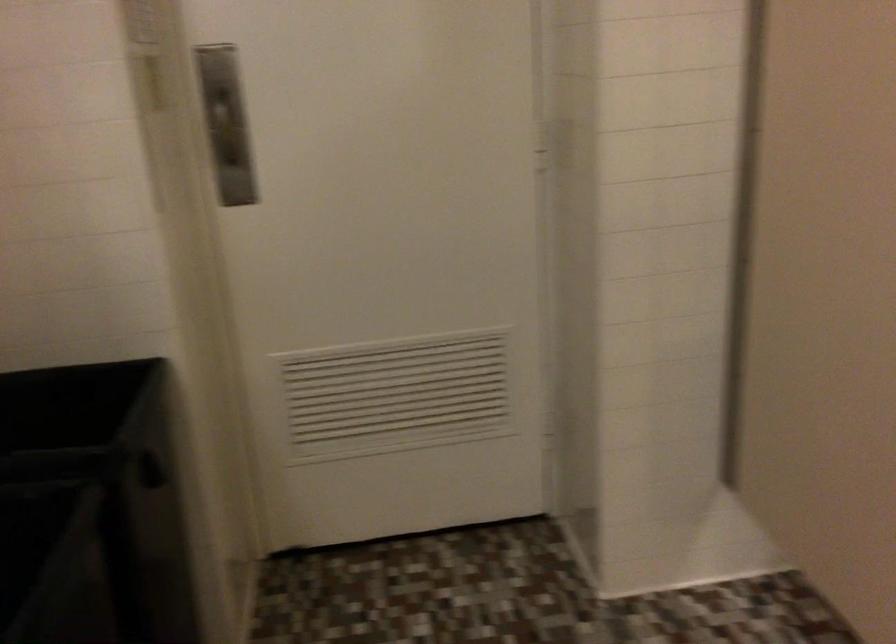
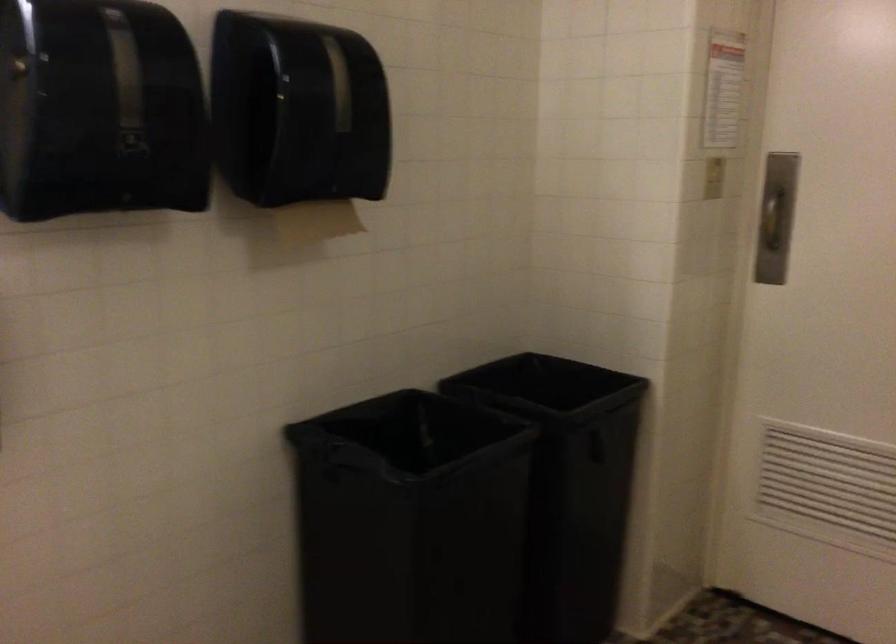
Locate, in the second image, the point that corresponds to point 182,433 in the first image.

(647, 438)